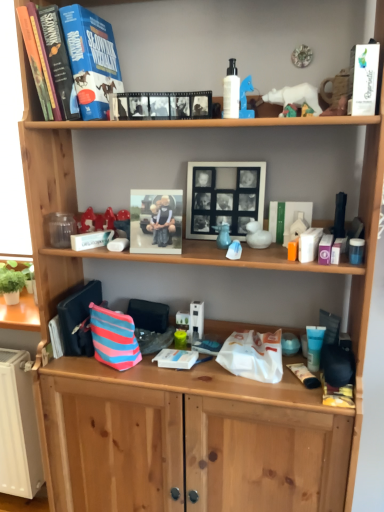
Question: Is matte plastic photo frame at center, arranged as the second picture frame when viewed from the right, in front of or behind matte plastic container at middle right, the 2th toiletry in the left-to-right sequence, in the image?

Choices:
 (A) behind
 (B) front

Answer: (A)

Question: From the image's perspective, is matte plastic photo frame at center, arranged as the second picture frame when viewed from the right, positioned above or below matte plastic container at middle right, which is the 2th toiletry from back to front?

Choices:
 (A) below
 (B) above

Answer: (B)

Question: Considering the real-world distances, which object is closest to the blue translucent tube at lower right, arranged as the first toiletry when viewed from the right?

Choices:
 (A) black matte picture frame at center, which is the 1th picture frame in right-to-left order
 (B) green matte book at center-right, arranged as the 1th book when ordered from the bottom
 (C) matte plastic container at middle right, which is the 2th toiletry from back to front
 (D) striped fabric pouch at lower center
 (E) matte plastic photo frame at center, which appears as the 1th picture frame when viewed from the left

Answer: (C)

Question: Estimate the real-world distances between objects in this image. Which object is farther from the white glossy lotion at upper center, which is the third toiletry in back-to-front order?

Choices:
 (A) hardcover book at upper left, which is the first paperback book from back to front
 (B) black matte film strip at upper center, which appears as the first book when viewed from the top
 (C) matte plastic container at middle right, which is the second toiletry from bottom to top
 (D) striped fabric pouch at lower center
 (E) white paper at upper right, acting as the 2th paperback book starting from the left

Answer: (D)